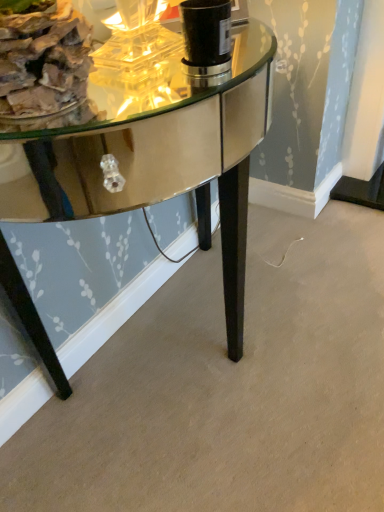
Question: From a real-world perspective, is shiny mirrored table at center positioned above or below wooden logs at left?

Choices:
 (A) below
 (B) above

Answer: (A)

Question: Visually, is shiny mirrored table at center positioned to the left or to the right of wooden logs at left?

Choices:
 (A) left
 (B) right

Answer: (B)

Question: Does point (23, 209) appear closer or farther from the camera than point (46, 87)?

Choices:
 (A) farther
 (B) closer

Answer: (A)

Question: Considering the positions of point (43, 42) and point (109, 138), is point (43, 42) closer or farther from the camera than point (109, 138)?

Choices:
 (A) closer
 (B) farther

Answer: (A)

Question: Relative to shiny mirrored table at center, is wooden logs at left in front or behind?

Choices:
 (A) behind
 (B) front

Answer: (A)

Question: From a real-world perspective, relative to shiny mirrored table at center, is wooden logs at left vertically above or below?

Choices:
 (A) below
 (B) above

Answer: (B)

Question: Is wooden logs at left bigger or smaller than shiny mirrored table at center?

Choices:
 (A) small
 (B) big

Answer: (A)